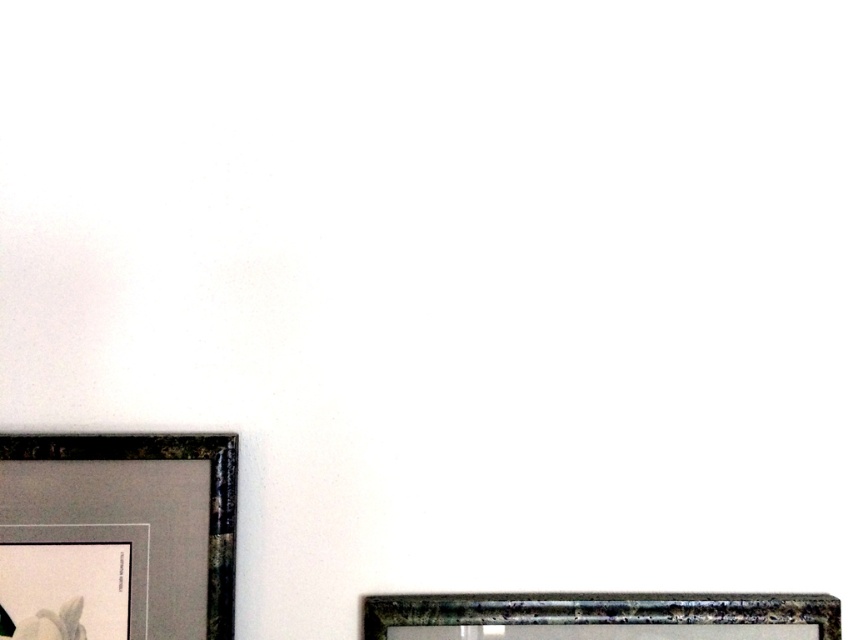
Question: Where is metallic silver picture frame at lower right located in relation to metallic gold picture frame at lower left in the image?

Choices:
 (A) left
 (B) right

Answer: (B)

Question: Among these objects, which one is nearest to the camera?

Choices:
 (A) metallic silver picture frame at lower right
 (B) metallic gold picture frame at lower left

Answer: (B)

Question: Observing the image, what is the correct spatial positioning of metallic silver picture frame at lower right in reference to metallic gold picture frame at lower left?

Choices:
 (A) below
 (B) above

Answer: (A)

Question: Which of the following is the farthest from the observer?

Choices:
 (A) coord(370,632)
 (B) coord(213,522)

Answer: (A)

Question: Is metallic silver picture frame at lower right behind metallic gold picture frame at lower left?

Choices:
 (A) no
 (B) yes

Answer: (B)